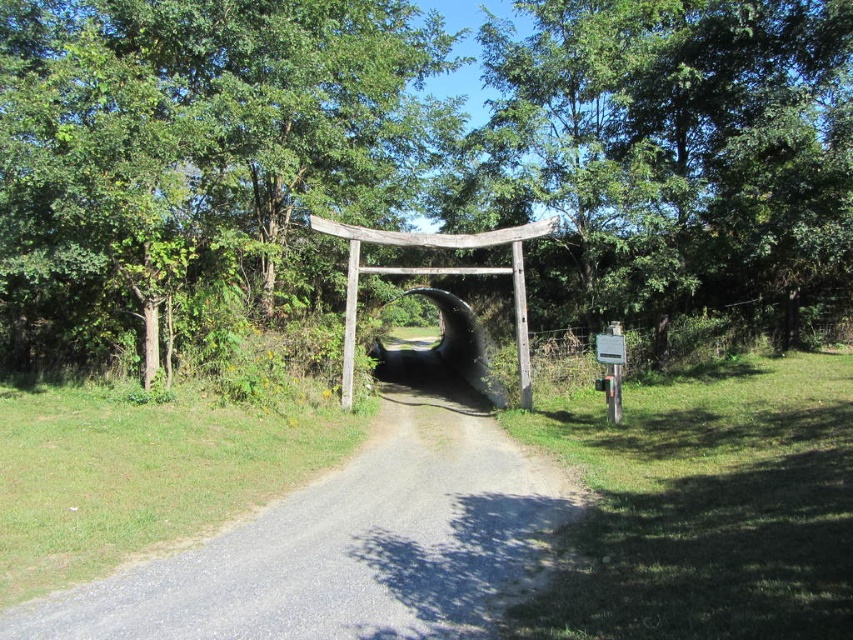
You are standing at the entrance of the torii gate and notice two green trees at the center of the image. Which tree is taller between the green wood tree at center and the green leafy tree at center?

The green wood tree at center is taller than the green leafy tree at center.

You are standing at the entrance of the torii gate and want to walk to the gray gravel path at center. Which direction should you walk to avoid the green wood tree at center?

You should walk to the right to reach the gray gravel path at center while avoiding the green wood tree at center, since the tree is positioned to the left of the path.